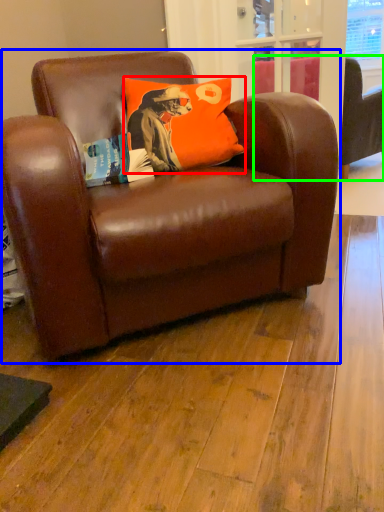
Question: Based on their relative distances, which object is farther from pillow (highlighted by a red box)? Choose from chair (highlighted by a blue box) and studio couch (highlighted by a green box).

Choices:
 (A) chair
 (B) studio couch

Answer: (B)